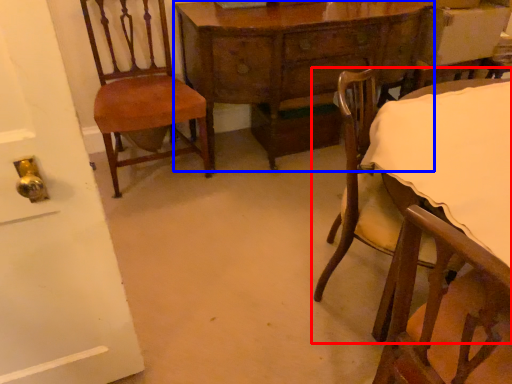
Question: Which object appears farthest to the camera in this image, chair (highlighted by a red box) or table (highlighted by a blue box)?

Choices:
 (A) chair
 (B) table

Answer: (B)